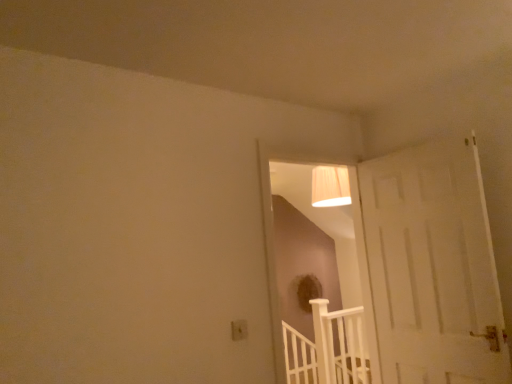
Question: Is white plastic electric outlet at lower center aimed at white wooden rail at lower center?

Choices:
 (A) no
 (B) yes

Answer: (A)

Question: From the image's perspective, is white plastic electric outlet at lower center located beneath white wooden rail at lower center?

Choices:
 (A) yes
 (B) no

Answer: (B)

Question: Is white plastic electric outlet at lower center beside white wooden rail at lower center?

Choices:
 (A) yes
 (B) no

Answer: (B)

Question: Is the depth of white plastic electric outlet at lower center greater than that of white wooden rail at lower center?

Choices:
 (A) yes
 (B) no

Answer: (B)

Question: Is white plastic electric outlet at lower center positioned with its back to white wooden rail at lower center?

Choices:
 (A) no
 (B) yes

Answer: (A)

Question: Considering the relative sizes of white plastic electric outlet at lower center and white wooden rail at lower center in the image provided, is white plastic electric outlet at lower center taller than white wooden rail at lower center?

Choices:
 (A) yes
 (B) no

Answer: (B)

Question: Considering the relative sizes of white wooden rail at lower center and white plastic electric outlet at lower center in the image provided, is white wooden rail at lower center taller than white plastic electric outlet at lower center?

Choices:
 (A) no
 (B) yes

Answer: (B)

Question: Can you confirm if white wooden rail at lower center is smaller than white plastic electric outlet at lower center?

Choices:
 (A) no
 (B) yes

Answer: (A)

Question: Is white wooden rail at lower center far away from white plastic electric outlet at lower center?

Choices:
 (A) no
 (B) yes

Answer: (B)

Question: Is white wooden rail at lower center looking in the opposite direction of white plastic electric outlet at lower center?

Choices:
 (A) yes
 (B) no

Answer: (B)

Question: From a real-world perspective, is white wooden rail at lower center under white plastic electric outlet at lower center?

Choices:
 (A) no
 (B) yes

Answer: (B)

Question: Is white wooden rail at lower center at the left side of white plastic electric outlet at lower center?

Choices:
 (A) no
 (B) yes

Answer: (A)

Question: Considering the positions of white plastic electric outlet at lower center and white wooden rail at lower center in the image, is white plastic electric outlet at lower center wider or thinner than white wooden rail at lower center?

Choices:
 (A) wide
 (B) thin

Answer: (B)